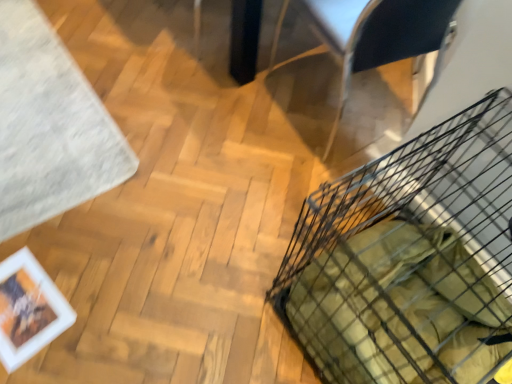
I want to click on free spot above white matte picture frame at lower left (from a real-world perspective), so click(x=21, y=302).